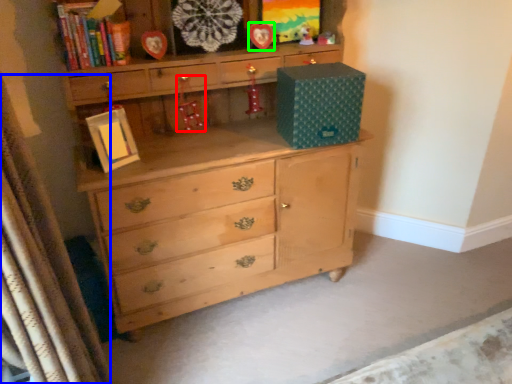
Question: Which object is the closest to the toy (highlighted by a red box)? Choose among these: curtain (highlighted by a blue box) or picture frame (highlighted by a green box).

Choices:
 (A) curtain
 (B) picture frame

Answer: (B)